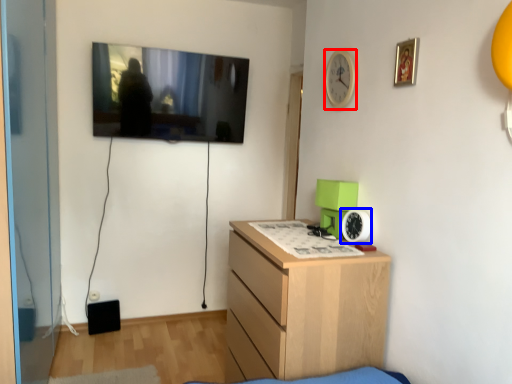
Question: Which object appears closest to the camera in this image, clock (highlighted by a red box) or clock (highlighted by a blue box)?

Choices:
 (A) clock
 (B) clock

Answer: (B)